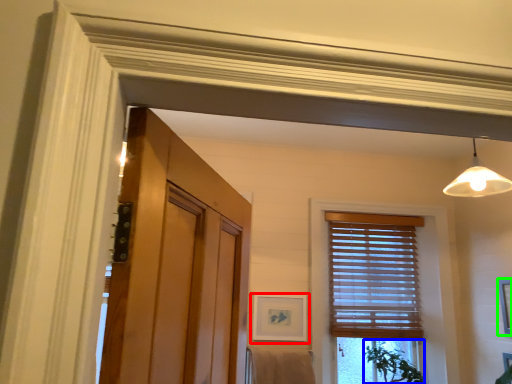
Question: Which is farther away from picture frame (highlighted by a red box)? plant (highlighted by a blue box) or picture frame (highlighted by a green box)?

Choices:
 (A) plant
 (B) picture frame

Answer: (B)